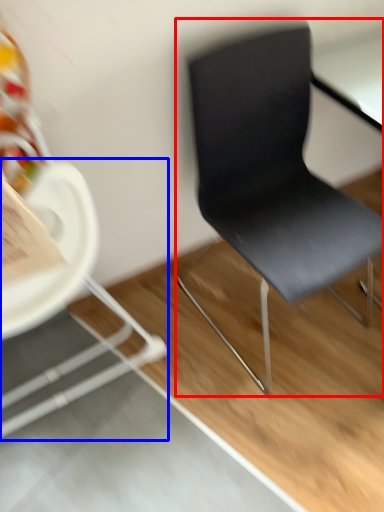
Question: Among these objects, which one is farthest to the camera, chair (highlighted by a red box) or chair (highlighted by a blue box)?

Choices:
 (A) chair
 (B) chair

Answer: (A)